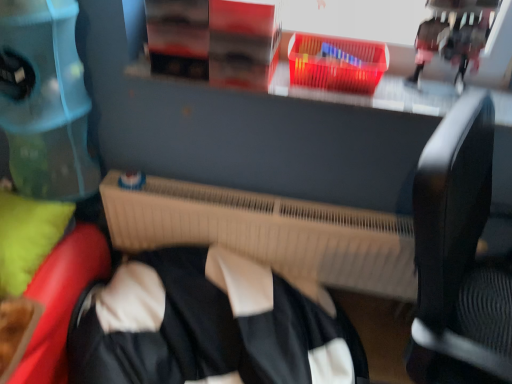
Question: Does translucent plastic basket at upper center have a greater height compared to beige plastic radiator at center?

Choices:
 (A) yes
 (B) no

Answer: (B)

Question: Is translucent plastic basket at upper center further to camera compared to beige plastic radiator at center?

Choices:
 (A) no
 (B) yes

Answer: (A)

Question: Is beige plastic radiator at center surrounded by translucent plastic basket at upper center?

Choices:
 (A) yes
 (B) no

Answer: (B)

Question: Considering the relative sizes of translucent plastic basket at upper center and beige plastic radiator at center in the image provided, is translucent plastic basket at upper center wider than beige plastic radiator at center?

Choices:
 (A) no
 (B) yes

Answer: (B)

Question: From a real-world perspective, is translucent plastic basket at upper center physically below beige plastic radiator at center?

Choices:
 (A) yes
 (B) no

Answer: (B)

Question: Can you confirm if translucent plastic basket at upper center is smaller than beige plastic radiator at center?

Choices:
 (A) no
 (B) yes

Answer: (B)

Question: Could you tell me if beige plastic radiator at center is facing translucent plastic basket at upper center?

Choices:
 (A) no
 (B) yes

Answer: (A)

Question: Is beige plastic radiator at center far away from translucent plastic basket at upper center?

Choices:
 (A) yes
 (B) no

Answer: (B)

Question: Can you confirm if beige plastic radiator at center is taller than translucent plastic basket at upper center?

Choices:
 (A) no
 (B) yes

Answer: (B)

Question: Is the surface of beige plastic radiator at center in direct contact with translucent plastic basket at upper center?

Choices:
 (A) yes
 (B) no

Answer: (B)

Question: Can you confirm if beige plastic radiator at center is positioned to the left of translucent plastic basket at upper center?

Choices:
 (A) no
 (B) yes

Answer: (B)

Question: Can you confirm if beige plastic radiator at center is thinner than translucent plastic basket at upper center?

Choices:
 (A) yes
 (B) no

Answer: (A)

Question: From a real-world perspective, is green fabric pillow at lower left positioned over beige plastic radiator at center based on gravity?

Choices:
 (A) no
 (B) yes

Answer: (B)